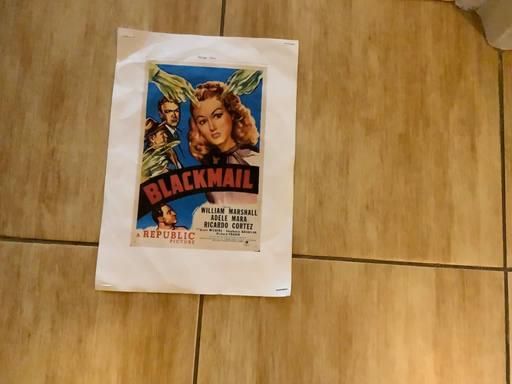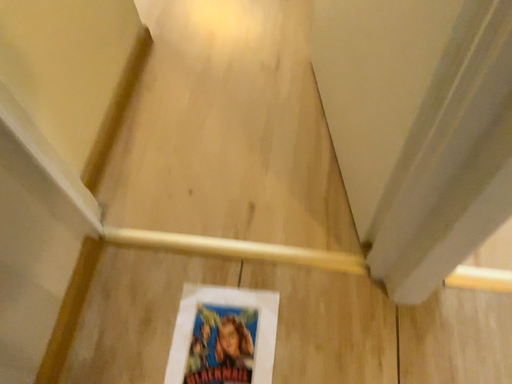
Question: How did the camera likely rotate when shooting the video?

Choices:
 (A) rotated downward
 (B) rotated upward

Answer: (B)